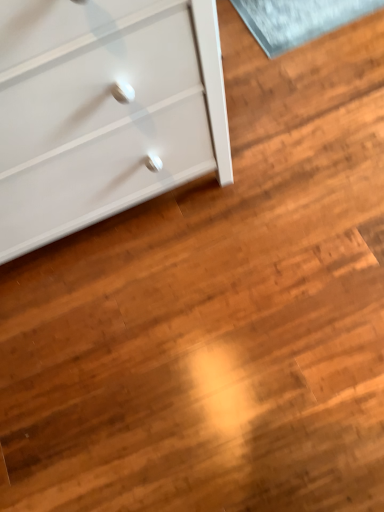
Where is `free point in front of white glossy chest of drawers at upper left`? The image size is (384, 512). free point in front of white glossy chest of drawers at upper left is located at coordinates (169, 338).